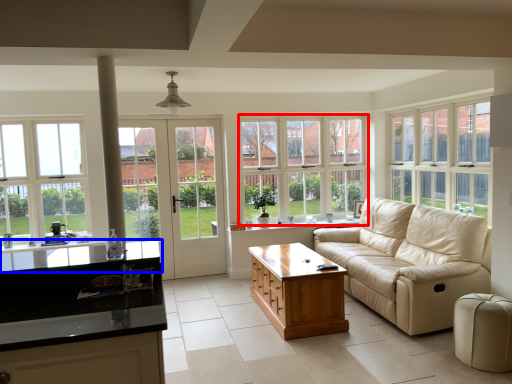
Question: Which object is further to the camera taking this photo, window (highlighted by a red box) or countertop (highlighted by a blue box)?

Choices:
 (A) window
 (B) countertop

Answer: (A)